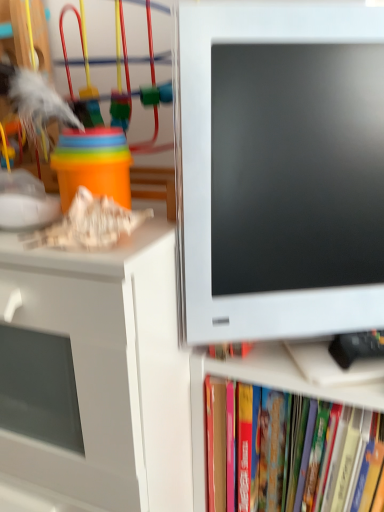
In order to face matte plastic cups at upper left, should I rotate leftwards or rightwards?

A 11.610 degree turn to the left will do.

This screenshot has height=512, width=384. I want to click on matte plastic cups at upper left, so click(89, 135).

What do you see at coordinates (280, 170) in the screenshot?
I see `satin white monitor at right` at bounding box center [280, 170].

Describe the element at coordinates (253, 446) in the screenshot. I see `hardcover book at lower right` at that location.

Locate an element on the screen. The height and width of the screenshot is (512, 384). matte plastic cups at upper left is located at coordinates (89, 135).

Based on their sizes in the image, would you say satin white monitor at right is bigger or smaller than matte plastic cups at upper left?

Clearly, satin white monitor at right is smaller in size than matte plastic cups at upper left.

From a real-world perspective, is satin white monitor at right located beneath matte plastic cups at upper left?

Yes.

Would you say satin white monitor at right is outside matte plastic cups at upper left?

Absolutely, satin white monitor at right is external to matte plastic cups at upper left.

Who is taller, satin white monitor at right or matte plastic cups at upper left?

satin white monitor at right.

Could you tell me if hardcover book at lower right is turned towards satin white monitor at right?

No.

In the image, is hardcover book at lower right positioned in front of or behind satin white monitor at right?

Clearly, hardcover book at lower right is behind satin white monitor at right.

Does point (321, 405) come behind point (295, 188)?

Yes, point (321, 405) is farther from viewer.

Considering the relative positions of hardcover book at lower right and satin white monitor at right in the image provided, is hardcover book at lower right to the left or to the right of satin white monitor at right?

Clearly, hardcover book at lower right is on the right of satin white monitor at right in the image.

From the image's perspective, which is below, matte plastic cups at upper left or hardcover book at lower right?

From the image's view, hardcover book at lower right is below.

Can you tell me how much matte plastic cups at upper left and hardcover book at lower right differ in facing direction?

They differ by 0.00165 degrees in their facing directions.

From a real-world perspective, who is located higher, matte plastic cups at upper left or hardcover book at lower right?

In real-world perspective, matte plastic cups at upper left is above.

Can you confirm if satin white monitor at right is shorter than white glossy cabinet at left?

Indeed, satin white monitor at right has a lesser height compared to white glossy cabinet at left.

Where is `desk below the satin white monitor at right (from a real-world perspective)`? desk below the satin white monitor at right (from a real-world perspective) is located at coordinates pyautogui.click(x=95, y=374).

From the image's perspective, is satin white monitor at right beneath white glossy cabinet at left?

No, from the image's perspective, satin white monitor at right is not below white glossy cabinet at left.

Considering the relative positions of satin white monitor at right and white glossy cabinet at left in the image provided, is satin white monitor at right to the left or to the right of white glossy cabinet at left?

Clearly, satin white monitor at right is on the right of white glossy cabinet at left in the image.

Which object is more forward, white glossy cabinet at left or matte plastic cups at upper left?

white glossy cabinet at left is in front.

Would you say white glossy cabinet at left is outside matte plastic cups at upper left?

white glossy cabinet at left is positioned outside matte plastic cups at upper left.

I want to click on desk on the left of matte plastic cups at upper left, so click(x=95, y=374).

Are white glossy cabinet at left and matte plastic cups at upper left located far from each other?

No, white glossy cabinet at left is in close proximity to matte plastic cups at upper left.

Does hardcover book at lower right appear on the right side of matte plastic cups at upper left?

Yes, hardcover book at lower right is to the right of matte plastic cups at upper left.

Is hardcover book at lower right completely or partially outside of matte plastic cups at upper left?

hardcover book at lower right lies outside matte plastic cups at upper left's area.

Is hardcover book at lower right taller or shorter than matte plastic cups at upper left?

In the image, hardcover book at lower right appears to be taller than matte plastic cups at upper left.

From the image's perspective, relative to matte plastic cups at upper left, is hardcover book at lower right above or below?

hardcover book at lower right is situated lower than matte plastic cups at upper left in the image.

You are a GUI agent. You are given a task and a screenshot of the screen. Output one action in this format:
    pyautogui.click(x=<x>, y=<y>)
    Task: Click on the computer monitor below the matte plastic cups at upper left (from a real-world perspective)
    
    Given the screenshot: What is the action you would take?
    pyautogui.click(x=280, y=170)

Is matte plastic cups at upper left in front of or behind satin white monitor at right in the image?

Visually, matte plastic cups at upper left is located behind satin white monitor at right.

Is matte plastic cups at upper left facing away from satin white monitor at right?

matte plastic cups at upper left does not have its back to satin white monitor at right.

From a real-world perspective, relative to satin white monitor at right, is matte plastic cups at upper left vertically above or below?

From a real-world perspective, matte plastic cups at upper left is physically above satin white monitor at right.

Locate an element on the screen. The width and height of the screenshot is (384, 512). computer monitor below the matte plastic cups at upper left (from a real-world perspective) is located at coordinates (280, 170).

Image resolution: width=384 pixels, height=512 pixels. I want to click on computer monitor that is in front of the hardcover book at lower right, so click(280, 170).

From the image, which object appears to be farther from hardcover book at lower right, satin white monitor at right or matte plastic cups at upper left?

matte plastic cups at upper left lies further to hardcover book at lower right than the other object.

Consider the image. Based on their spatial positions, is hardcover book at lower right or white glossy cabinet at left closer to satin white monitor at right?

white glossy cabinet at left lies closer to satin white monitor at right than the other object.

From the image, which object appears to be farther from matte plastic cups at upper left, satin white monitor at right or hardcover book at lower right?

Based on the image, hardcover book at lower right appears to be further to matte plastic cups at upper left.

In the scene shown: When comparing their distances from hardcover book at lower right, does matte plastic cups at upper left or white glossy cabinet at left seem closer?

Among the two, white glossy cabinet at left is located nearer to hardcover book at lower right.

Estimate the real-world distances between objects in this image. Which object is further from white glossy cabinet at left, satin white monitor at right or matte plastic cups at upper left?

matte plastic cups at upper left is further to white glossy cabinet at left.

Looking at the image, which one is located further to satin white monitor at right, matte plastic cups at upper left or hardcover book at lower right?

The object further to satin white monitor at right is hardcover book at lower right.

Looking at this image, which object lies nearer to the anchor point hardcover book at lower right, matte plastic cups at upper left or satin white monitor at right?

Among the two, satin white monitor at right is located nearer to hardcover book at lower right.

Consider the image. Looking at the image, which one is located closer to matte plastic cups at upper left, white glossy cabinet at left or hardcover book at lower right?

white glossy cabinet at left is closer to matte plastic cups at upper left.

Where is `desk between matte plastic cups at upper left and hardcover book at lower right vertically`? The height and width of the screenshot is (512, 384). desk between matte plastic cups at upper left and hardcover book at lower right vertically is located at coordinates (95, 374).

The width and height of the screenshot is (384, 512). Identify the location of computer monitor between matte plastic cups at upper left and white glossy cabinet at left in the up-down direction. (280, 170).

Where is `computer monitor that lies between matte plastic cups at upper left and hardcover book at lower right from top to bottom`? The image size is (384, 512). computer monitor that lies between matte plastic cups at upper left and hardcover book at lower right from top to bottom is located at coordinates (280, 170).

This screenshot has height=512, width=384. In order to click on computer monitor between white glossy cabinet at left and hardcover book at lower right in this screenshot , I will do `click(280, 170)`.